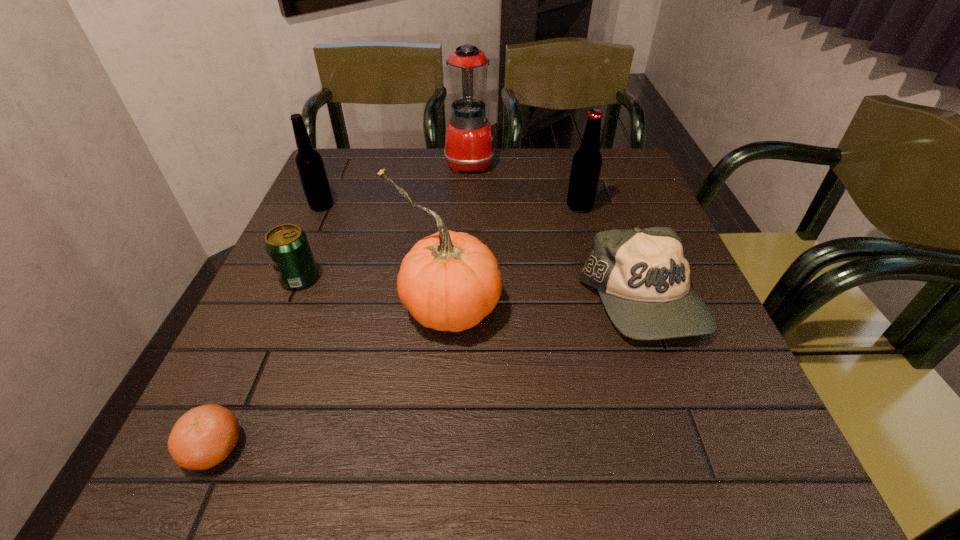
Where is `free space that satisfies the following two spatial constraints: 1. on the front side of the beer can; 2. on the right side of the left beer bottle`? free space that satisfies the following two spatial constraints: 1. on the front side of the beer can; 2. on the right side of the left beer bottle is located at coordinates (289, 279).